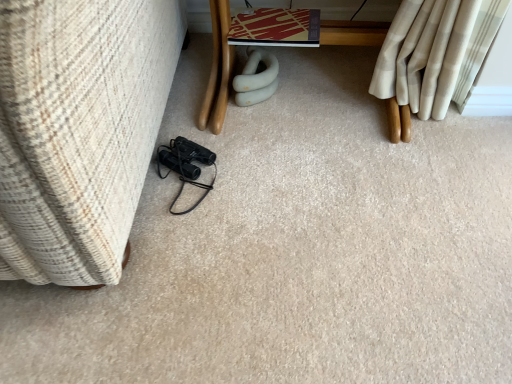
Describe the element at coordinates (218, 70) in the screenshot. I see `wooden table at center` at that location.

Locate an element on the screen. The width and height of the screenshot is (512, 384). wooden table at center is located at coordinates (218, 70).

The image size is (512, 384). I want to click on wooden table at center, so click(218, 70).